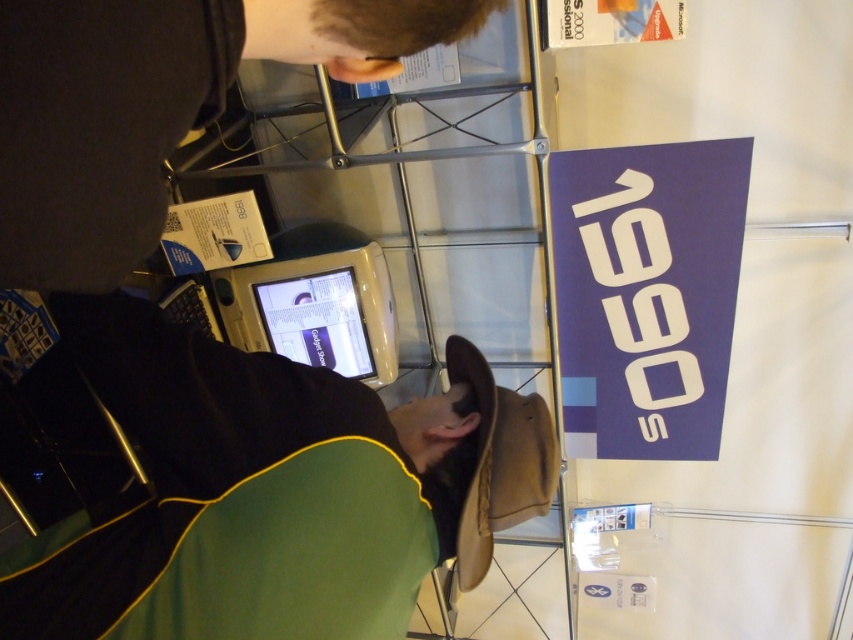
Describe the element at coordinates (276, 490) in the screenshot. I see `black matte hat at center` at that location.

Is black matte hat at center smaller than matte blue sign at upper right?

Yes.

What do you see at coordinates (276, 490) in the screenshot? The image size is (853, 640). I see `black matte hat at center` at bounding box center [276, 490].

This screenshot has width=853, height=640. What are the coordinates of `black matte hat at center` in the screenshot? It's located at (276, 490).

Can you confirm if matte blue sign at upper right is wider than matte plastic computer screen at center?

Correct, the width of matte blue sign at upper right exceeds that of matte plastic computer screen at center.

Between matte blue sign at upper right and matte plastic computer screen at center, which one is positioned lower?

matte plastic computer screen at center is below.

Is point (724, 221) positioned before point (291, 339)?

Yes, it is.

Image resolution: width=853 pixels, height=640 pixels. Identify the location of matte blue sign at upper right. (646, 292).

Locate an element on the screen. This screenshot has width=853, height=640. black matte hat at center is located at coordinates coord(276,490).

Does black matte hat at center have a greater width compared to white plastic computer at center?

Yes, black matte hat at center is wider than white plastic computer at center.

The image size is (853, 640). What do you see at coordinates (276, 490) in the screenshot?
I see `black matte hat at center` at bounding box center [276, 490].

Where is `black matte hat at center`? This screenshot has height=640, width=853. black matte hat at center is located at coordinates (276, 490).